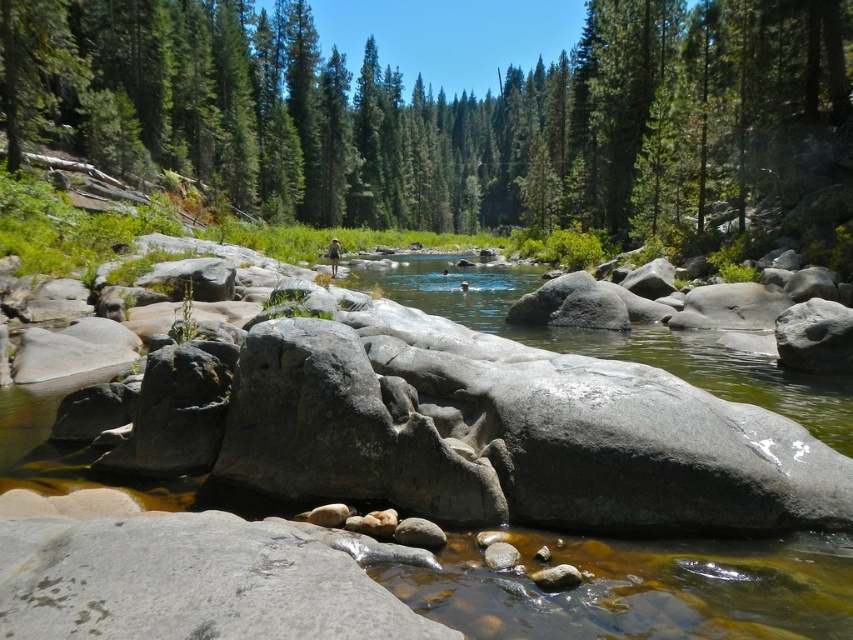
You are navigating a small boat along the river in the image. You notice two points marked on your map at coordinates point (15, 131) and point (509, 547). Which point should you approach first if you want to follow the river from upstream to downstream?

You should approach point (509, 547) first because point (15, 131) is behind it, indicating the river flows from the latter to the former downstream direction.

Looking at this image, you are standing at the edge of the river and want to take a photo of the smooth gray rock at center and the green matte forest at center. Based on their positions, which object should you frame first in your camera viewfinder to capture both in the same shot?

You should frame the smooth gray rock at center first because the green matte forest at center is to the right of it, so positioning the rock first allows the forest to naturally fit into the frame to its right.